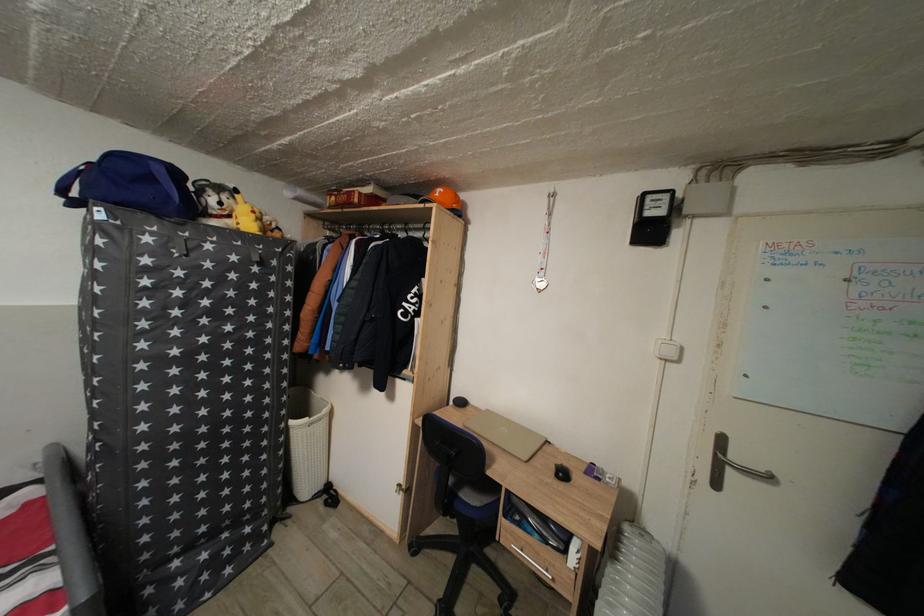
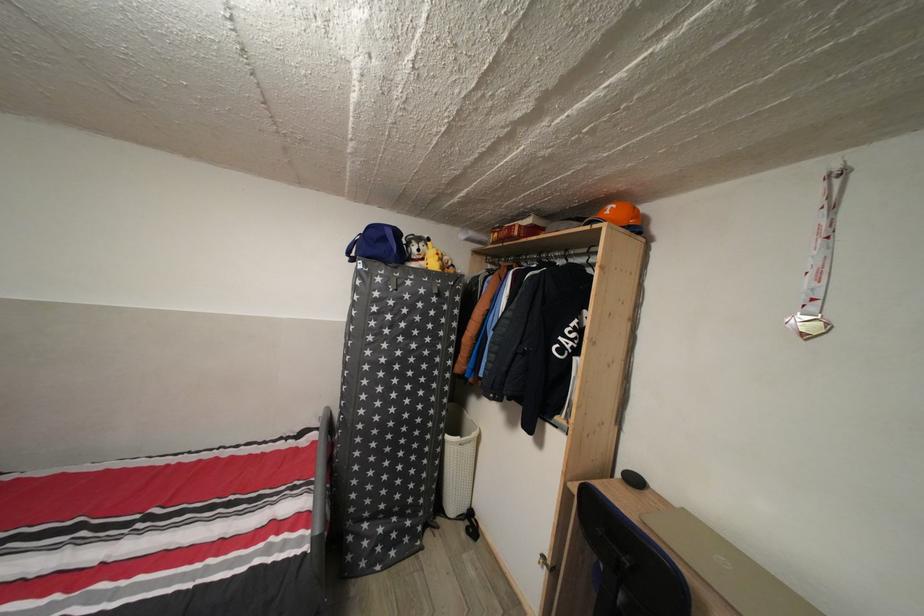
Locate, in the second image, the point that corresponds to pixel 157 185 in the first image.

(391, 246)